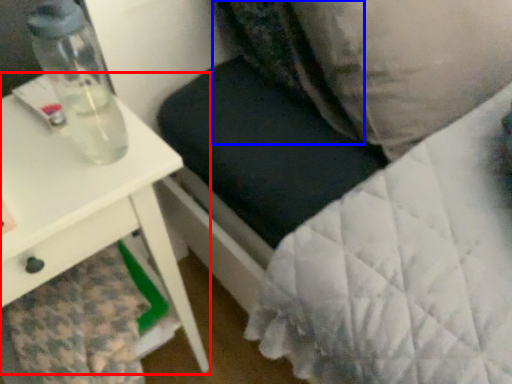
Question: Which of the following is the closest to the observer, table (highlighted by a red box) or pillow (highlighted by a blue box)?

Choices:
 (A) table
 (B) pillow

Answer: (A)